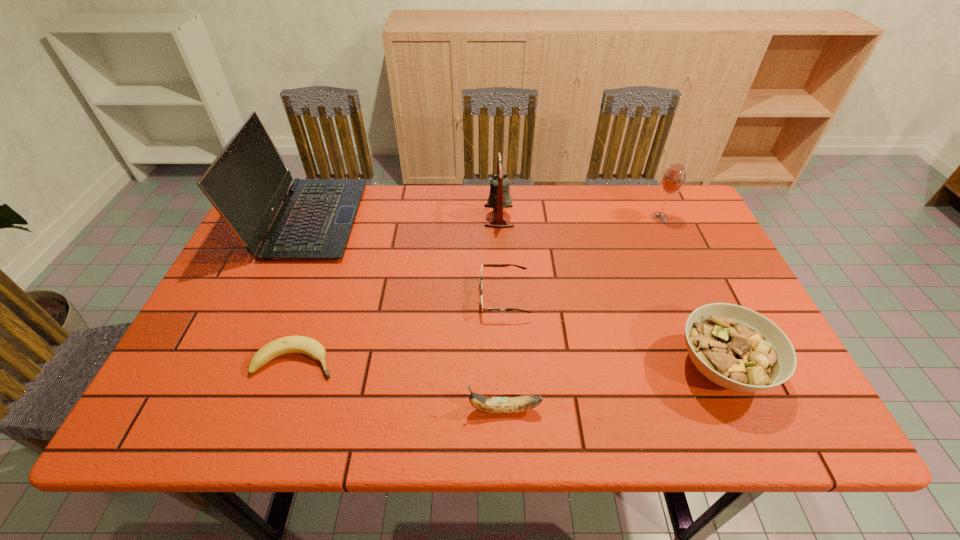
Where is `vacant space situated 0.110m on the screen of the tallest object`? The image size is (960, 540). vacant space situated 0.110m on the screen of the tallest object is located at coordinates (x=394, y=220).

This screenshot has height=540, width=960. Find the location of `vacant space located 0.270m on the right of the bell`. vacant space located 0.270m on the right of the bell is located at coordinates (603, 216).

Identify the location of vacant region located on the left of the wineglass. The width and height of the screenshot is (960, 540). (586, 217).

Locate an element on the screen. vacant point located on the back of the stew is located at coordinates (668, 246).

Where is `vacant space located 0.080m at the stem of the taller banana`? The height and width of the screenshot is (540, 960). vacant space located 0.080m at the stem of the taller banana is located at coordinates (428, 409).

Identify the location of vacant space located at the stem of the taller banana. The width and height of the screenshot is (960, 540). (275, 409).

This screenshot has width=960, height=540. In order to click on vacant space situated at the stem of the taller banana in this screenshot , I will do `click(348, 409)`.

Identify the location of blank space located on the frame of the fourth nearest object. (364, 296).

Find the location of a particular element. vacant position located 0.320m on the frame of the fourth nearest object is located at coordinates (352, 296).

The image size is (960, 540). What are the coordinates of `free space located 0.160m on the frame of the fourth nearest object` in the screenshot? It's located at (416, 296).